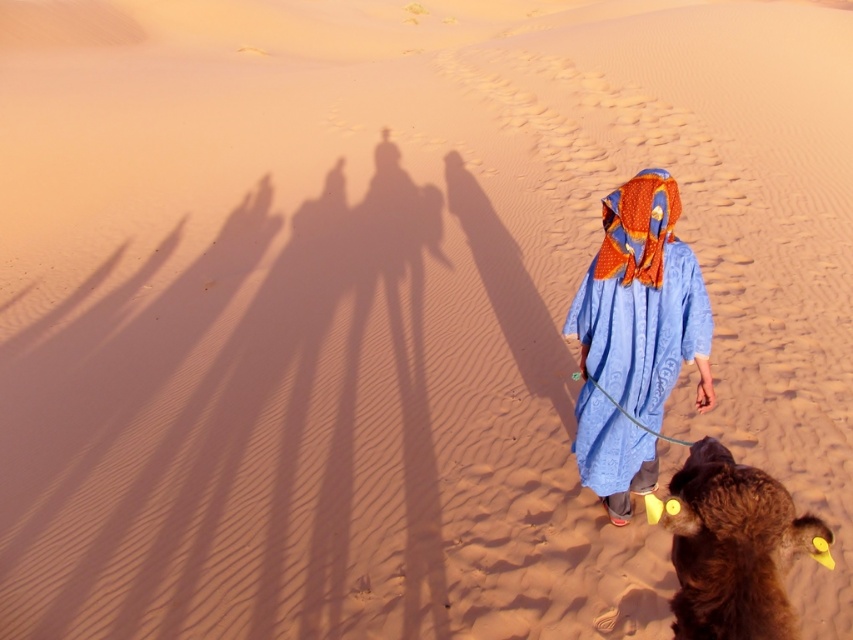
Can you confirm if blue woven fabric at center is wider than brown fuzzy camel at lower right?

Yes, blue woven fabric at center is wider than brown fuzzy camel at lower right.

Is point (613, 396) closer to camera compared to point (721, 458)?

That is False.

You are a GUI agent. You are given a task and a screenshot of the screen. Output one action in this format:
    pyautogui.click(x=<x>, y=<y>)
    Task: Click on the blue woven fabric at center
    
    Given the screenshot: What is the action you would take?
    pyautogui.click(x=642, y=301)